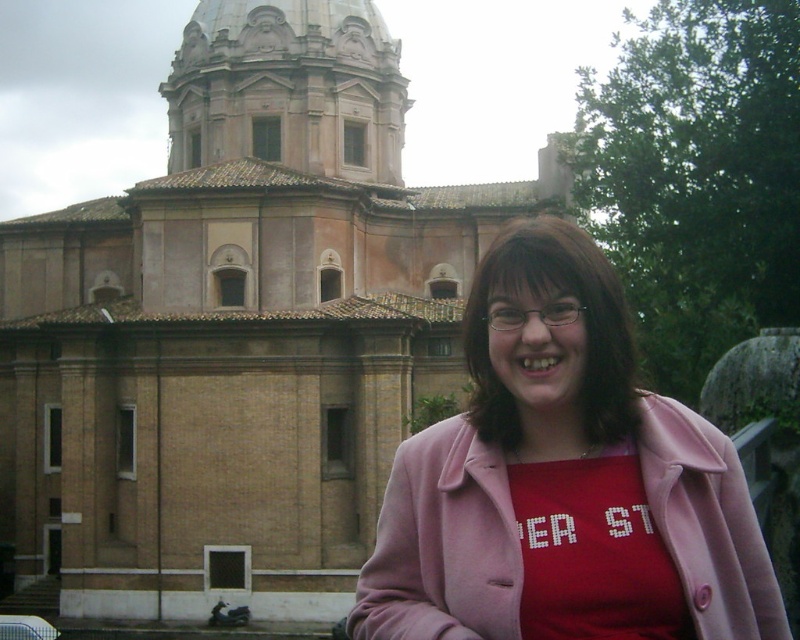
Question: Does beige stone church at center have a greater width compared to pink fabric at center?

Choices:
 (A) yes
 (B) no

Answer: (A)

Question: Can you confirm if beige stone church at center is positioned to the left of pink fabric at center?

Choices:
 (A) no
 (B) yes

Answer: (B)

Question: Which point appears farthest from the camera in this image?

Choices:
 (A) (742, 529)
 (B) (344, 212)

Answer: (B)

Question: Is beige stone church at center positioned before pink fabric at center?

Choices:
 (A) no
 (B) yes

Answer: (A)

Question: Among these points, which one is farthest from the camera?

Choices:
 (A) click(252, 419)
 (B) click(564, 369)

Answer: (A)